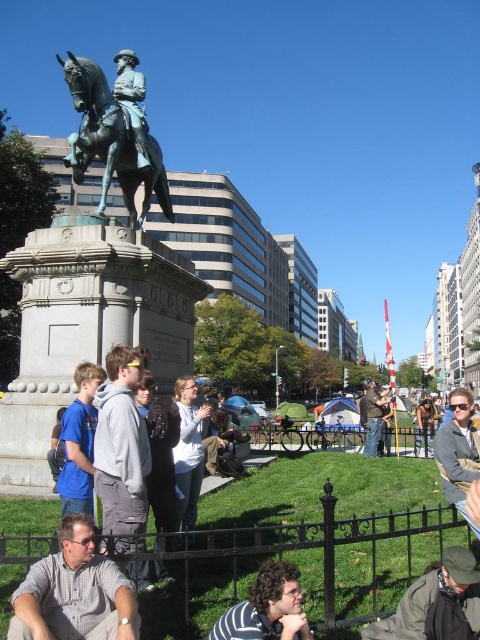
Does point (446, 454) come farther from viewer compared to point (372, 449)?

That is False.

Is point (439, 429) positioned behind point (383, 394)?

No.

Identify the location of gray knit sweater at lower right. The height and width of the screenshot is (640, 480). (457, 451).

Measure the distance from bronze statue at center to blue cotton shirt at lower left.

They are 23.76 feet apart.

Is bronze statue at center shorter than blue cotton shirt at lower left?

No.

The width and height of the screenshot is (480, 640). Identify the location of bronze statue at center. (x=93, y=280).

Does bronze statue at center have a greater height compared to gray fleece jacket at center?

Yes.

Who is more forward, (156, 179) or (110, 452)?

Positioned in front is point (110, 452).

This screenshot has width=480, height=640. I want to click on bronze statue at center, so click(x=93, y=280).